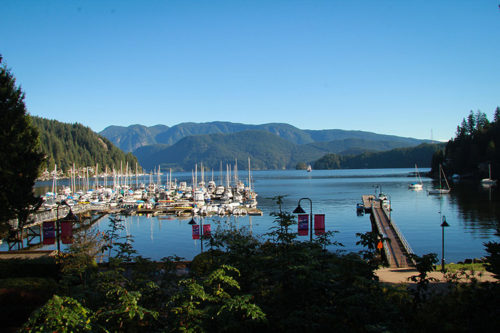
Identify the location of light. This screenshot has width=500, height=333. (298, 208).